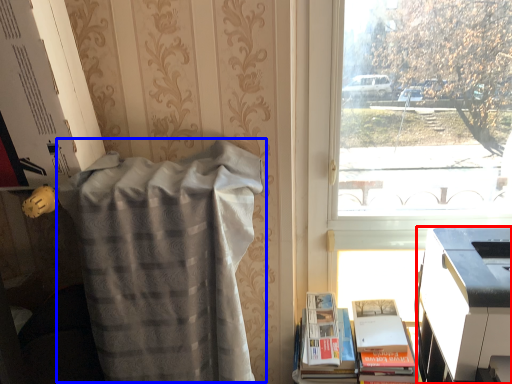
Question: Among these objects, which one is nearest to the camera, printer (highlighted by a red box) or blanket (highlighted by a blue box)?

Choices:
 (A) printer
 (B) blanket

Answer: (A)